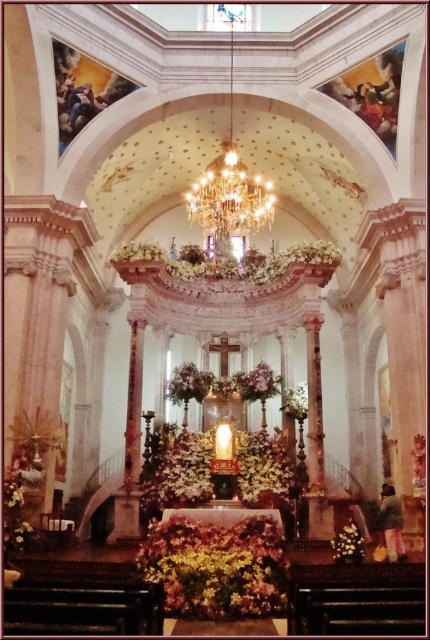
Does floral bouquet at center appear over white matte flower at center?

Correct, floral bouquet at center is located above white matte flower at center.

Can you confirm if floral bouquet at center is positioned below white matte flower at center?

Actually, floral bouquet at center is above white matte flower at center.

You are a GUI agent. You are given a task and a screenshot of the screen. Output one action in this format:
    pyautogui.click(x=<x>, y=<y>)
    Task: Click on the floral bouquet at center
    Image resolution: width=430 pixels, height=640 pixels.
    Given the screenshot: What is the action you would take?
    pyautogui.click(x=230, y=260)

You are a GUI agent. You are given a task and a screenshot of the screen. Output one action in this format:
    pyautogui.click(x=<x>, y=<y>)
    Task: Click on the floral bouquet at center
    
    Given the screenshot: What is the action you would take?
    pyautogui.click(x=230, y=260)

Is yellow-green fabric at lower center further to camera compared to floral bouquet at center?

No, yellow-green fabric at lower center is in front of floral bouquet at center.

Does yellow-green fabric at lower center lie in front of floral bouquet at center?

Yes, yellow-green fabric at lower center is in front of floral bouquet at center.

Who is more forward, (239, 612) or (162, 257)?

Point (239, 612) is more forward.

Locate an element on the screen. Image resolution: width=430 pixels, height=640 pixels. yellow-green fabric at lower center is located at coordinates (217, 566).

Is floral arrangement at center below pink fabric flower at center?

Indeed, floral arrangement at center is positioned under pink fabric flower at center.

Describe the element at coordinates (214, 472) in the screenshot. This screenshot has height=640, width=430. I see `floral arrangement at center` at that location.

Is point (288, 465) positioned before point (264, 388)?

Yes, point (288, 465) is in front of point (264, 388).

You are a GUI agent. You are given a task and a screenshot of the screen. Output one action in this format:
    pyautogui.click(x=<x>, y=<y>)
    Task: Click on the floral arrangement at center
    
    Given the screenshot: What is the action you would take?
    pyautogui.click(x=214, y=472)